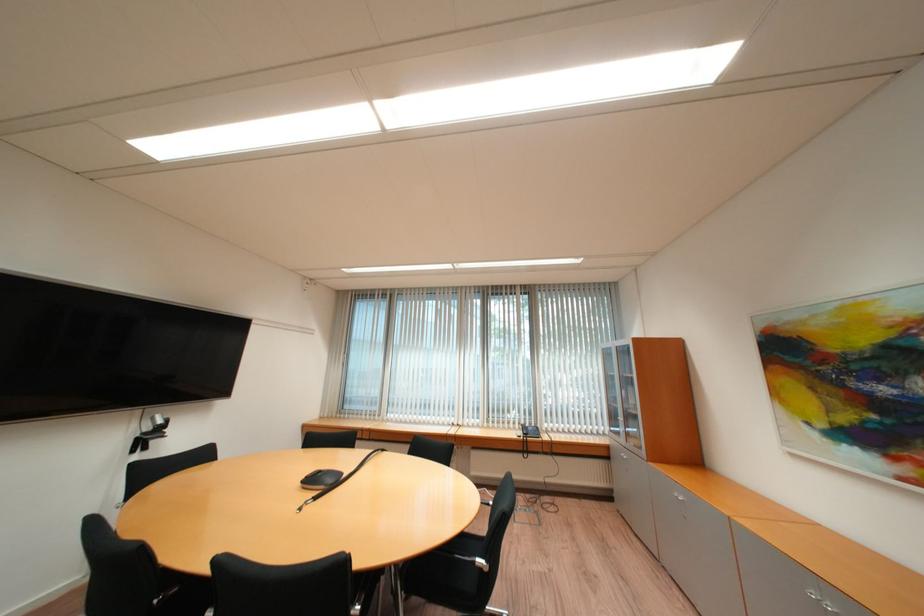
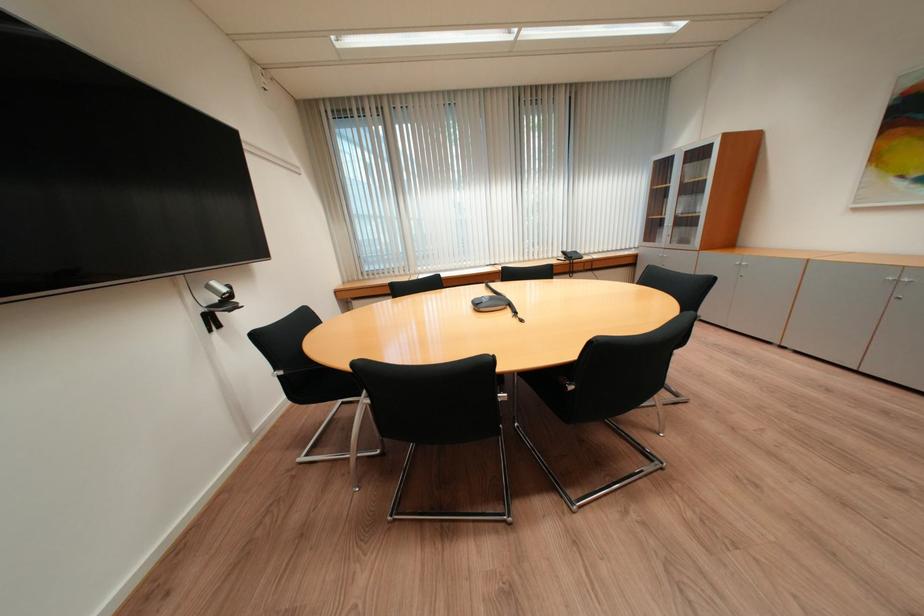
In the second image, find the point that corresponds to point (162, 419) in the first image.

(217, 289)